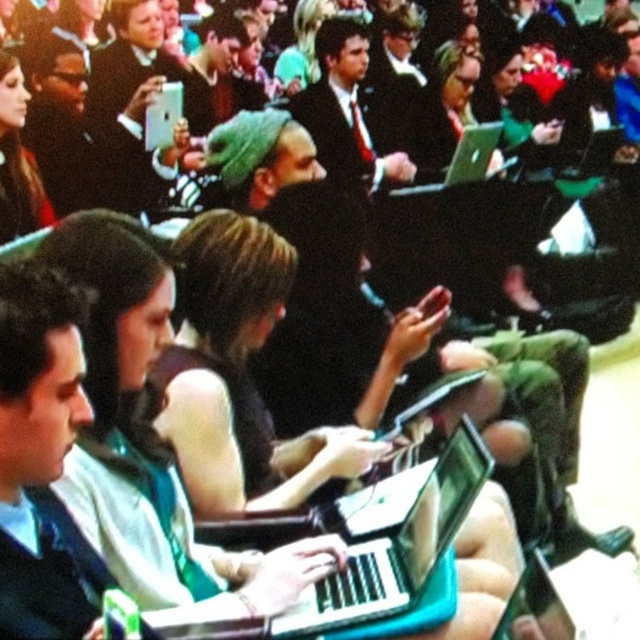
You are a photographer at a conference. You need to take a photo of the dark suit at center without getting too close. The camera you have has a maximum focus range of 15 feet. Can you take the photo from your current position?

The dark suit at center and camera are 12.81 feet apart, so yes, you can take the photo from your current position since the distance is within the camera maximum focus range of 15 feet.

You are sitting at the back of the conference room and want to hand a document to the person in the dark suit at center. Based on their position, which direction should you move to approach them?

The dark suit at center is located at point coordinates, so you should move forward towards the center of the room to reach them.

You are an event organizer who needs to adjust seating arrangements. You notice the matte black laptop at center and the dark suit at center. Which object is closer to the floor?

The matte black laptop at center is closer to the floor because it is positioned under the dark suit at center.